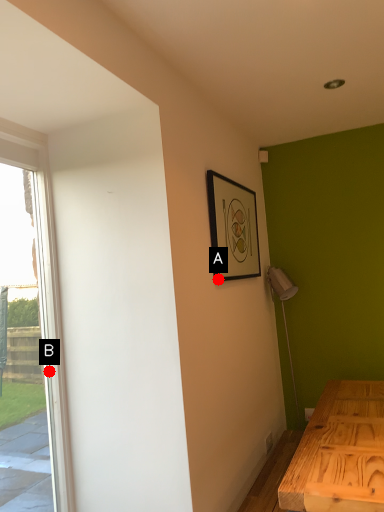
Question: Two points are circled on the image, labeled by A and B beside each circle. Which point appears farthest from the camera in this image?

Choices:
 (A) A is further
 (B) B is further

Answer: (A)